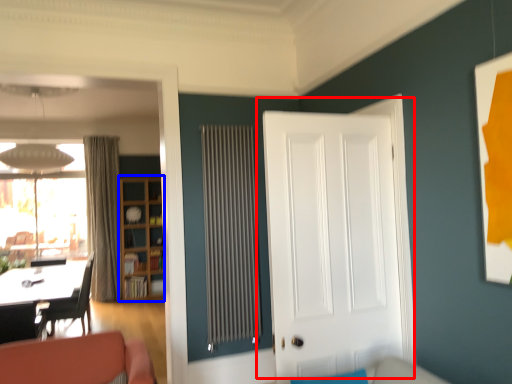
Question: Which object is closer to the camera taking this photo, door (highlighted by a red box) or bookshelf (highlighted by a blue box)?

Choices:
 (A) door
 (B) bookshelf

Answer: (A)